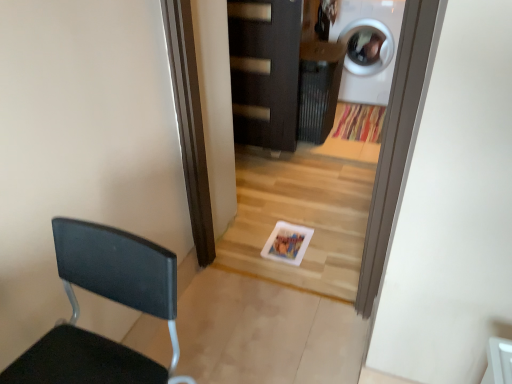
Question: From a real-world perspective, is white glossy washing machine at upper right above or below black matte chair at left?

Choices:
 (A) below
 (B) above

Answer: (A)

Question: Based on their sizes in the image, would you say white glossy washing machine at upper right is bigger or smaller than black matte chair at left?

Choices:
 (A) big
 (B) small

Answer: (A)

Question: Which of these objects is positioned closest to the black matte chair at left?

Choices:
 (A) dark wood door at center
 (B) white glossy washing machine at upper right

Answer: (A)

Question: Which is nearer to the black matte chair at left?

Choices:
 (A) white glossy washing machine at upper right
 (B) dark wood door at center

Answer: (B)